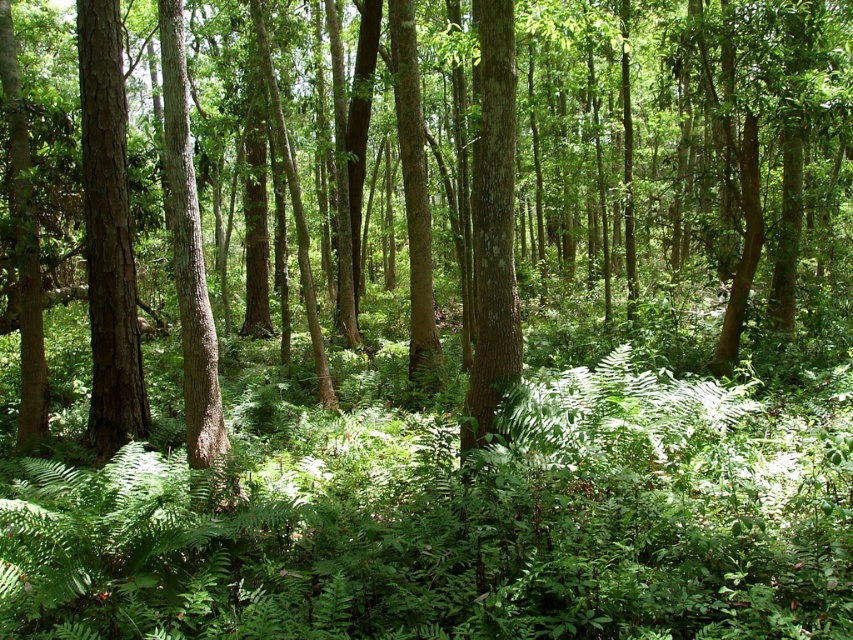
Which is behind, point (105, 138) or point (187, 310)?

Positioned behind is point (105, 138).

Describe the element at coordinates (108, 234) in the screenshot. I see `smooth brown tree trunk at left` at that location.

Describe the element at coordinates (108, 234) in the screenshot. I see `smooth brown tree trunk at left` at that location.

Where is `smooth brown tree trunk at left`? Image resolution: width=853 pixels, height=640 pixels. smooth brown tree trunk at left is located at coordinates (108, 234).